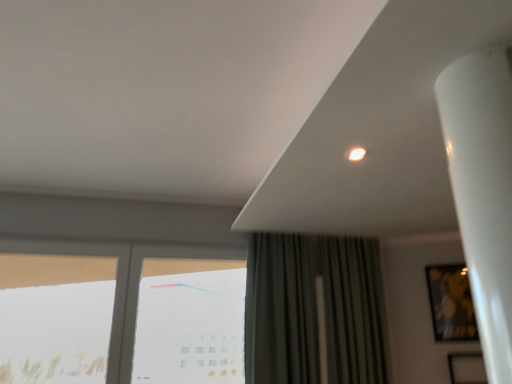
Question: Considering the relative positions of transparent glass window at left, placed as the third window when sorted from right to left, and metallic gold picture frame at right in the image provided, is transparent glass window at left, placed as the third window when sorted from right to left, to the right of metallic gold picture frame at right from the viewer's perspective?

Choices:
 (A) no
 (B) yes

Answer: (A)

Question: From a real-world perspective, does transparent glass window at left, positioned as the 1th window in left-to-right order, stand above metallic gold picture frame at right?

Choices:
 (A) yes
 (B) no

Answer: (B)

Question: Is metallic gold picture frame at right located within transparent glass window at left, placed as the third window when sorted from right to left?

Choices:
 (A) yes
 (B) no

Answer: (B)

Question: Can you confirm if transparent glass window at left, positioned as the 1th window in left-to-right order, is wider than metallic gold picture frame at right?

Choices:
 (A) yes
 (B) no

Answer: (A)

Question: Is transparent glass window at left, placed as the third window when sorted from right to left, behind metallic gold picture frame at right?

Choices:
 (A) yes
 (B) no

Answer: (B)

Question: Does point (13, 296) appear closer or farther from the camera than point (41, 322)?

Choices:
 (A) closer
 (B) farther

Answer: (A)

Question: In terms of size, does transparent glass window at left, placed as the third window when sorted from right to left, appear bigger or smaller than transparent glass window at lower left, marked as the second window in a right-to-left arrangement?

Choices:
 (A) small
 (B) big

Answer: (A)

Question: Is transparent glass window at left, positioned as the 1th window in left-to-right order, to the left or to the right of transparent glass window at lower left, marked as the second window in a right-to-left arrangement, in the image?

Choices:
 (A) right
 (B) left

Answer: (B)

Question: Looking at their shapes, would you say transparent glass window at left, positioned as the 1th window in left-to-right order, is wider or thinner than transparent glass window at lower left, the second window positioned from the left?

Choices:
 (A) thin
 (B) wide

Answer: (A)

Question: Would you say transparent glass window at left, placed as the third window when sorted from right to left, is to the left or to the right of transparent glass window at center, marked as the 3th window in a left-to-right arrangement, in the picture?

Choices:
 (A) left
 (B) right

Answer: (A)

Question: From the image's perspective, is transparent glass window at left, placed as the third window when sorted from right to left, located above or below transparent glass window at center, which ranks as the first window in right-to-left order?

Choices:
 (A) below
 (B) above

Answer: (B)

Question: Is point (16, 337) positioned closer to the camera than point (159, 281)?

Choices:
 (A) farther
 (B) closer

Answer: (B)

Question: In terms of width, does transparent glass window at left, placed as the third window when sorted from right to left, look wider or thinner when compared to transparent glass window at center, marked as the 3th window in a left-to-right arrangement?

Choices:
 (A) thin
 (B) wide

Answer: (A)

Question: Visually, is transparent glass window at center, which ranks as the first window in right-to-left order, positioned to the left or to the right of transparent glass window at left, placed as the third window when sorted from right to left?

Choices:
 (A) left
 (B) right

Answer: (B)

Question: Considering their positions, is transparent glass window at center, which ranks as the first window in right-to-left order, located in front of or behind transparent glass window at left, placed as the third window when sorted from right to left?

Choices:
 (A) front
 (B) behind

Answer: (B)